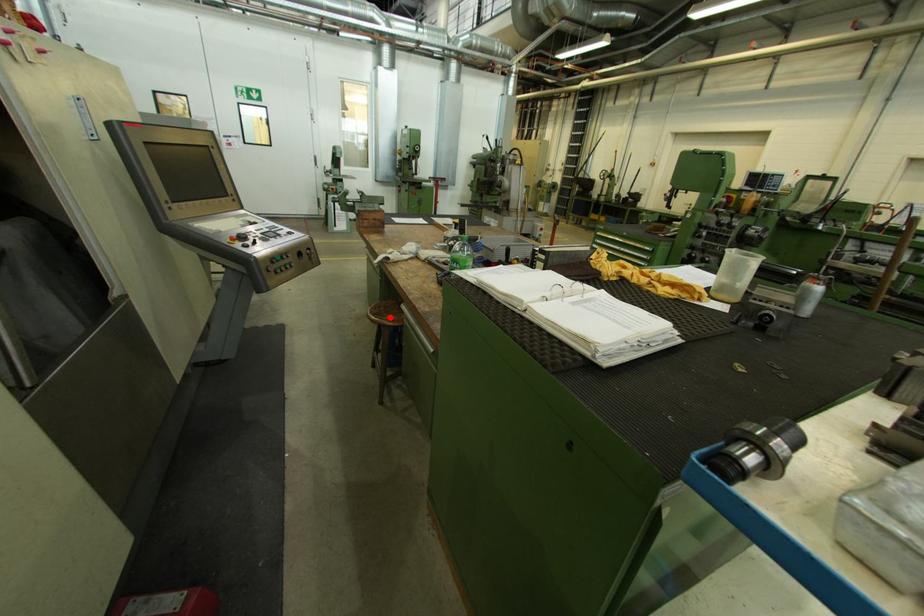
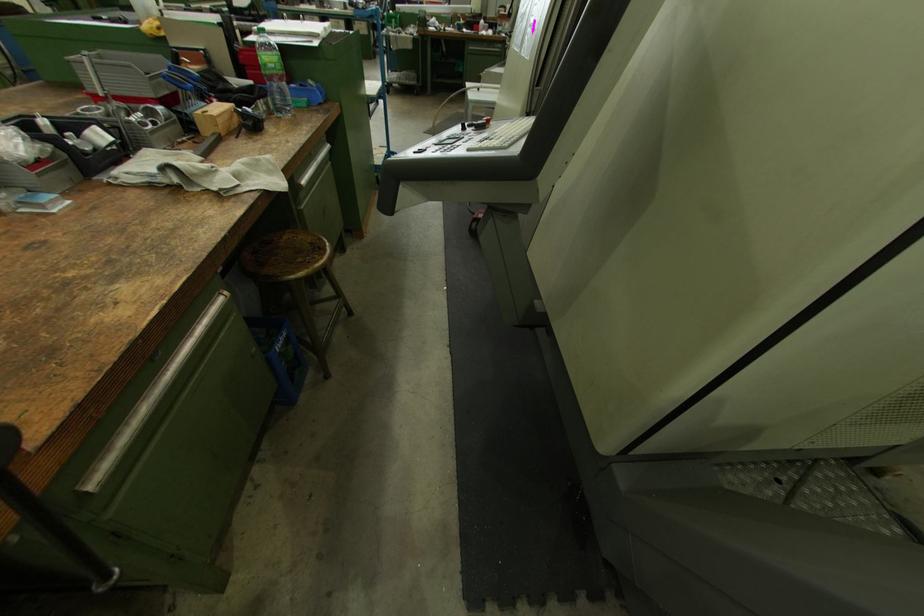
The point at the highlighted location is marked in the first image. Where is the corresponding point in the second image?

(317, 244)